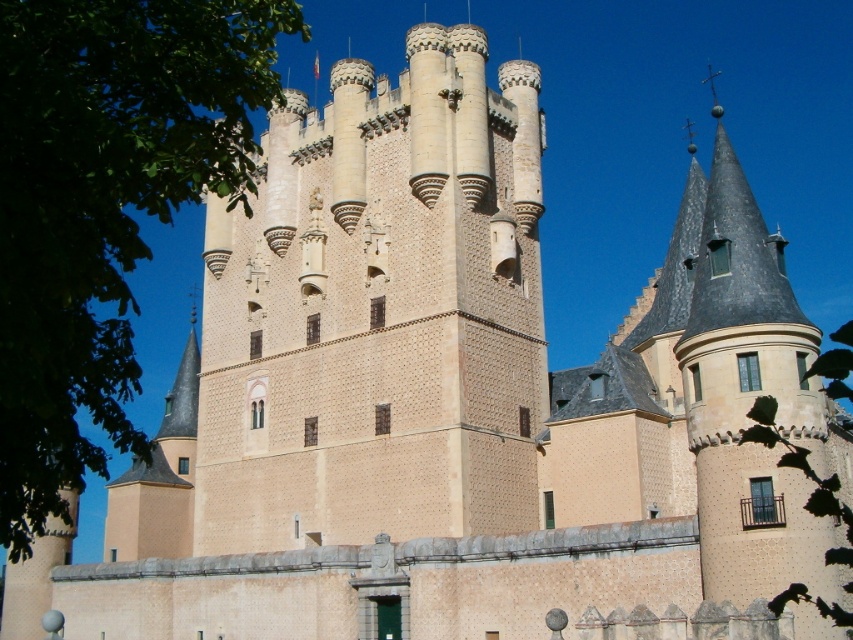
Question: Which point is closer to the camera?

Choices:
 (A) (297, 205)
 (B) (126, 332)

Answer: (B)

Question: Which point is closer to the camera?

Choices:
 (A) (28, 467)
 (B) (370, 205)

Answer: (A)

Question: Which point is farther from the camera taking this photo?

Choices:
 (A) (526, 392)
 (B) (152, 3)

Answer: (A)

Question: Does beige stone tower at center have a lesser width compared to green leafy tree at upper left?

Choices:
 (A) no
 (B) yes

Answer: (B)

Question: Where is beige stone tower at center located in relation to green leafy tree at upper left in the image?

Choices:
 (A) below
 (B) above

Answer: (A)

Question: Can you confirm if beige stone tower at center is smaller than green leafy tree at upper left?

Choices:
 (A) no
 (B) yes

Answer: (B)